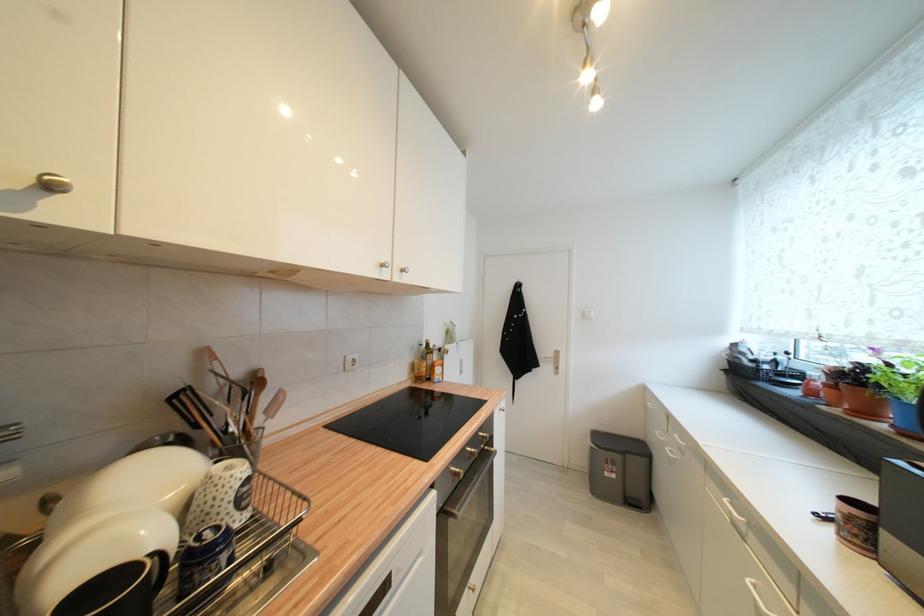
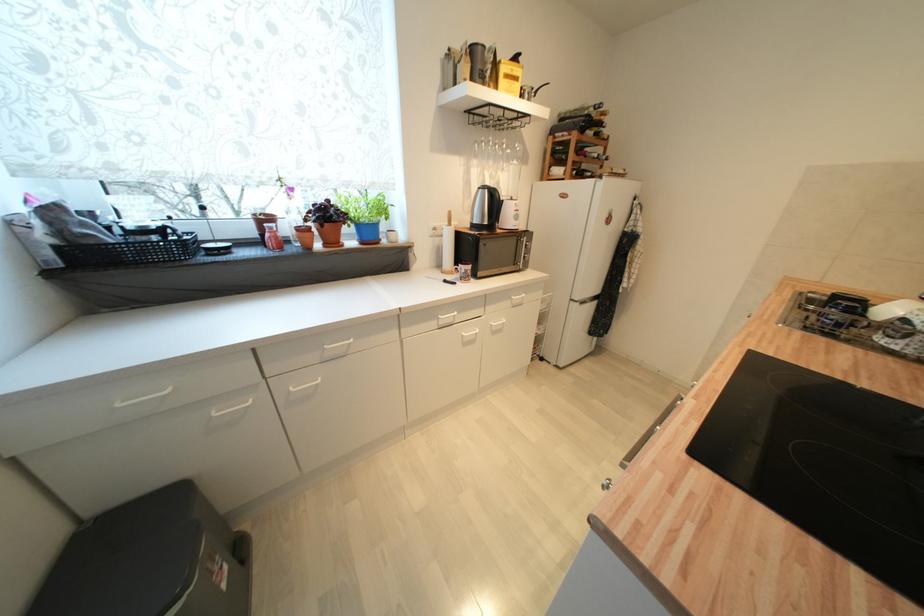
The point at (612, 476) is marked in the first image. Where is the corresponding point in the second image?

(228, 588)